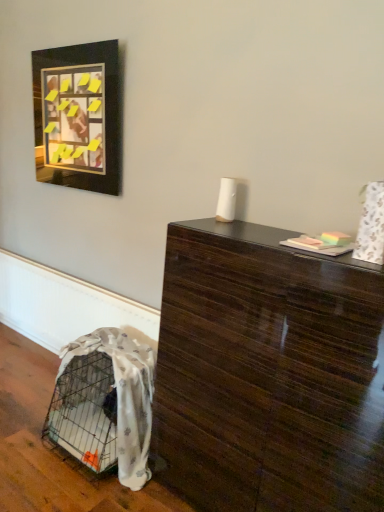
Identify the location of free location to the left of white textured blanket at lower left. (24, 432).